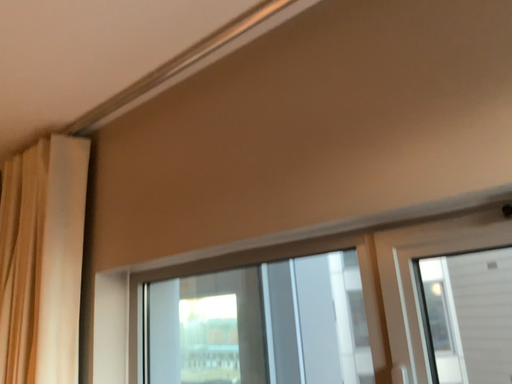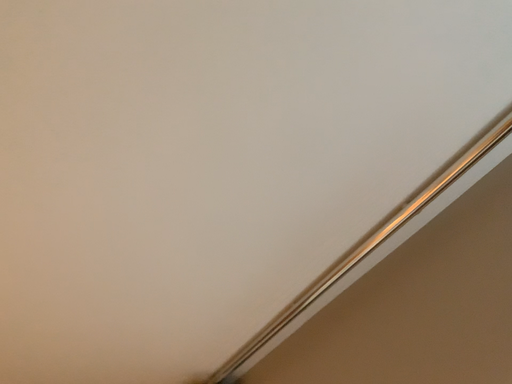
Question: Which way did the camera rotate in the video?

Choices:
 (A) rotated upward
 (B) rotated downward

Answer: (A)